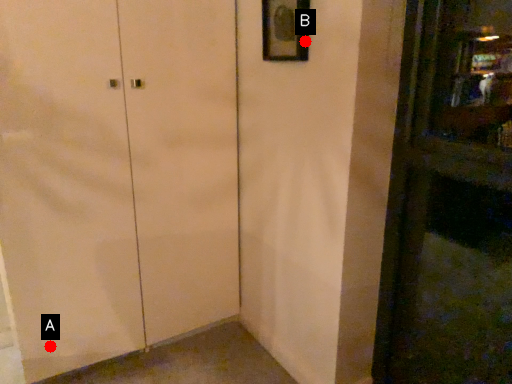
Question: Two points are circled on the image, labeled by A and B beside each circle. Among these points, which one is nearest to the camera?

Choices:
 (A) A is closer
 (B) B is closer

Answer: (B)